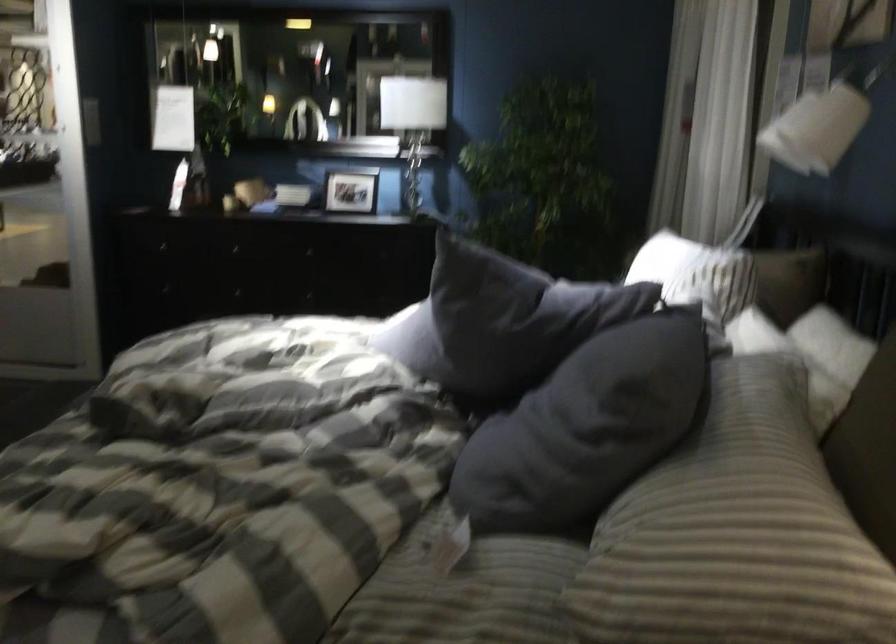
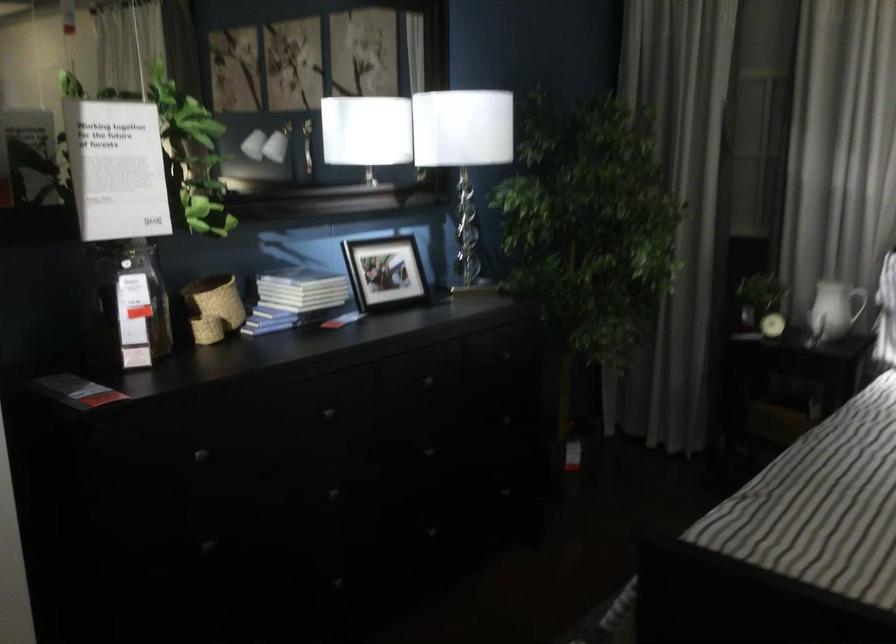
Locate, in the second image, the point that corresponds to [177,147] in the first image.

(126, 305)